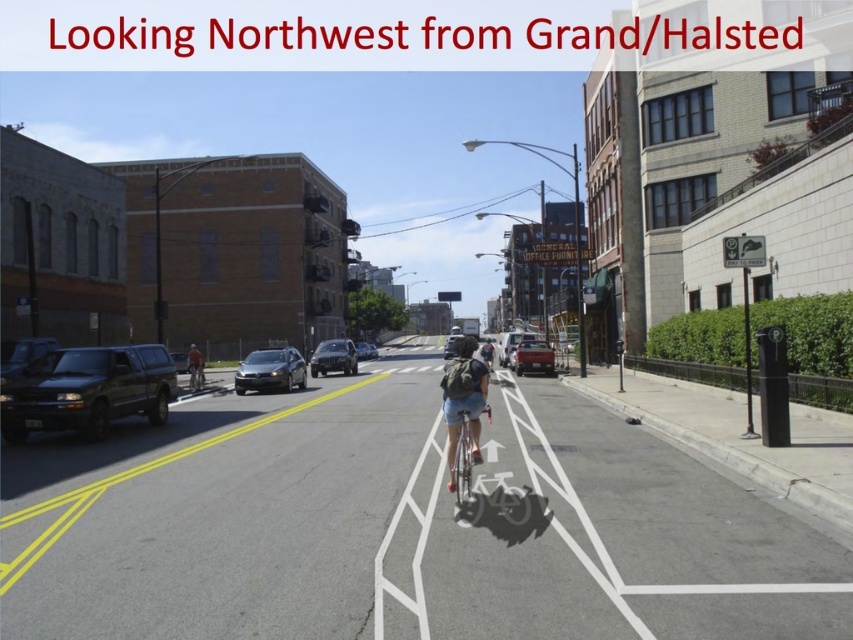
Consider the image. Is denim shorts at center smaller than dark gray helmet at center?

Correct, denim shorts at center occupies less space than dark gray helmet at center.

Does denim shorts at center have a greater width compared to dark gray helmet at center?

In fact, denim shorts at center might be narrower than dark gray helmet at center.

This screenshot has width=853, height=640. In order to click on denim shorts at center in this screenshot , I will do `click(463, 401)`.

Is matte black suv at left shorter than dark gray helmet at center?

In fact, matte black suv at left may be taller than dark gray helmet at center.

Who is positioned more to the left, matte black suv at left or dark gray helmet at center?

matte black suv at left is more to the left.

The height and width of the screenshot is (640, 853). In order to click on matte black suv at left in this screenshot , I will do `click(88, 390)`.

Is satin silver sedan at center taller than orange fabric backpack at center?

Correct, satin silver sedan at center is much taller as orange fabric backpack at center.

The width and height of the screenshot is (853, 640). Describe the element at coordinates (270, 371) in the screenshot. I see `satin silver sedan at center` at that location.

Locate an element on the screen. The width and height of the screenshot is (853, 640). satin silver sedan at center is located at coordinates (270, 371).